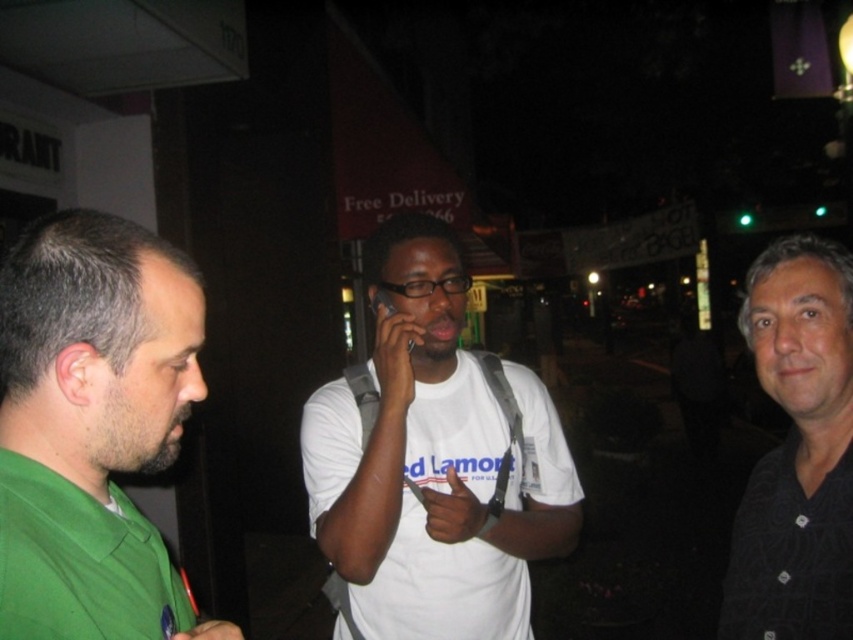
You are standing at the point labeled as point (7,282). You want to move to the nearest streetlight to charge your phone. The nearest streetlight is 25 inches away from you. Can you safely walk to it without needing to move more than 30 inches?

The distance between you and the viewer is 31.16 inches. Since the nearest streetlight is 25 inches away from you, you can safely walk to it as 25 inches is less than 30 inches.